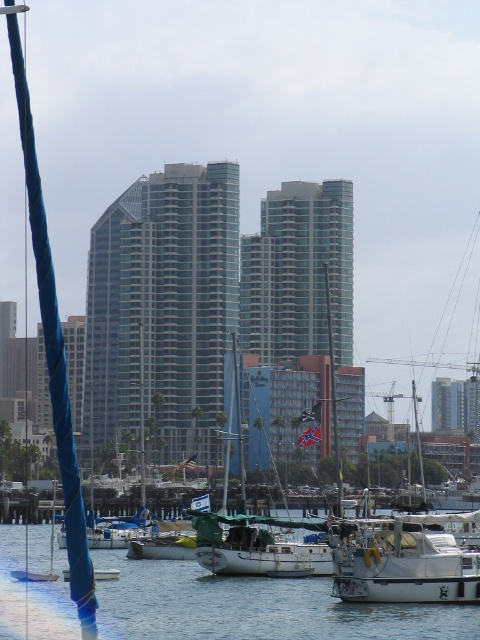
You are standing at the point with coordinates (x=407, y=561) in the image. What object is exactly at this location?

The white matte boat at center is exactly at point (x=407, y=561).

You are a photographer planning to capture the waterfront scene. You want to ensure that the clear water at lower center and the white matte sailboat at center are both visible in your shot. Based on their relative heights, which object should appear closer to the bottom of the photo?

The clear water at lower center is shorter than the white matte sailboat at center, so the clear water at lower center will appear closer to the bottom of the photo.